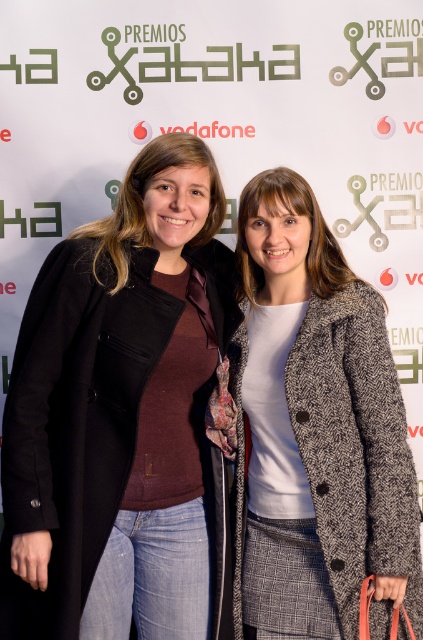
Can you confirm if matte black coat at center is positioned to the right of white textured coat at center?

No, matte black coat at center is not to the right of white textured coat at center.

Can you confirm if matte black coat at center is smaller than white textured coat at center?

No, matte black coat at center is not smaller than white textured coat at center.

Locate an element on the screen. The width and height of the screenshot is (423, 640). matte black coat at center is located at coordinates (123, 417).